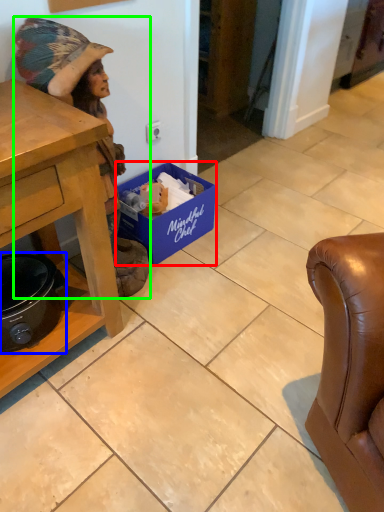
Question: Which object is positioned farthest from box (highlighted by a red box)? Select from appliance (highlighted by a blue box) and person (highlighted by a green box).

Choices:
 (A) appliance
 (B) person

Answer: (A)